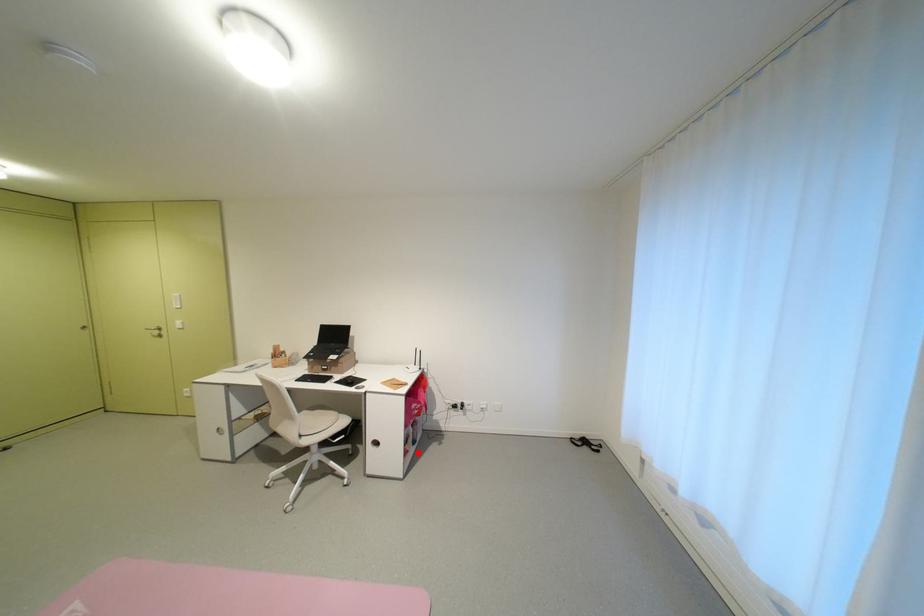
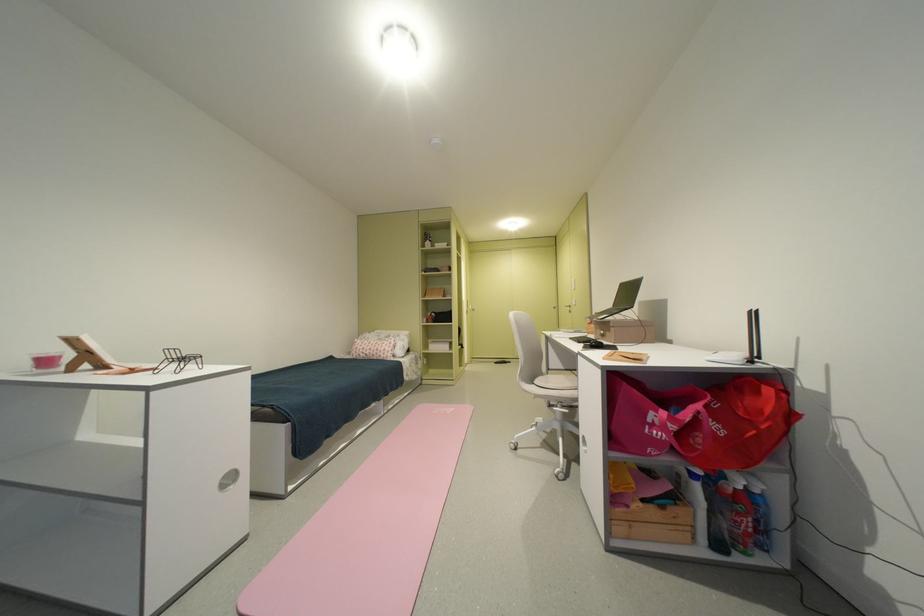
Question: I am providing you with two images of the same scene from different viewpoints. A red point is shown in image1. For the corresponding object point in image2, is it positioned nearer or farther from the camera?

Choices:
 (A) Nearer
 (B) Farther

Answer: (B)